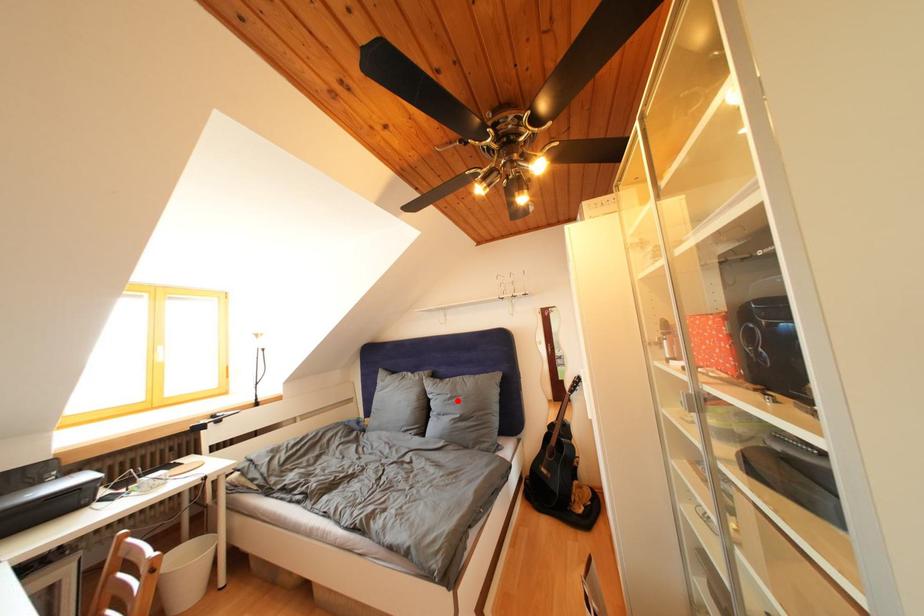
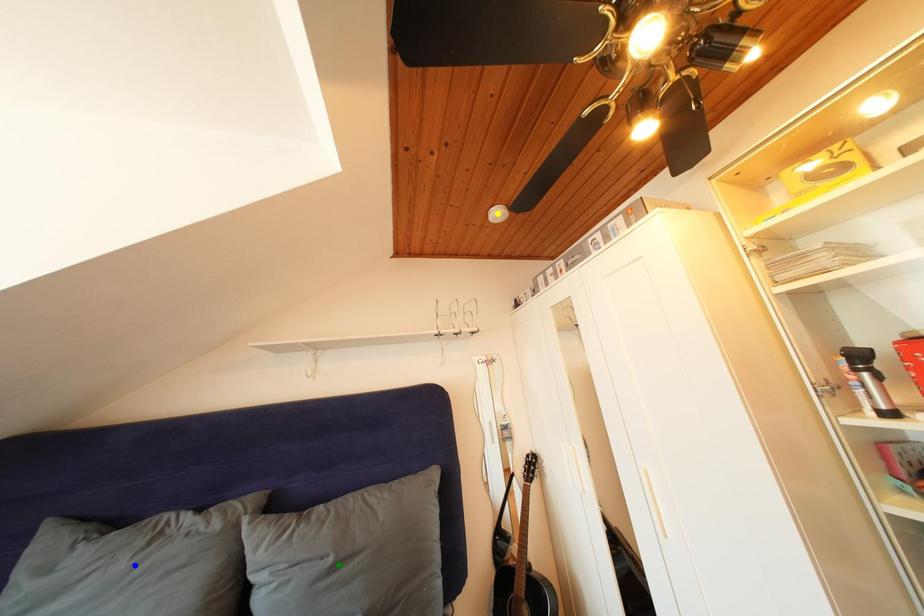
Question: I am providing you with two images of the same scene from different viewpoints. A red point is marked on the first image. You are given multiple points on the second image. Which mark in image 2 goes with the point in image 1?

Choices:
 (A) green point
 (B) blue point
 (C) yellow point

Answer: (A)